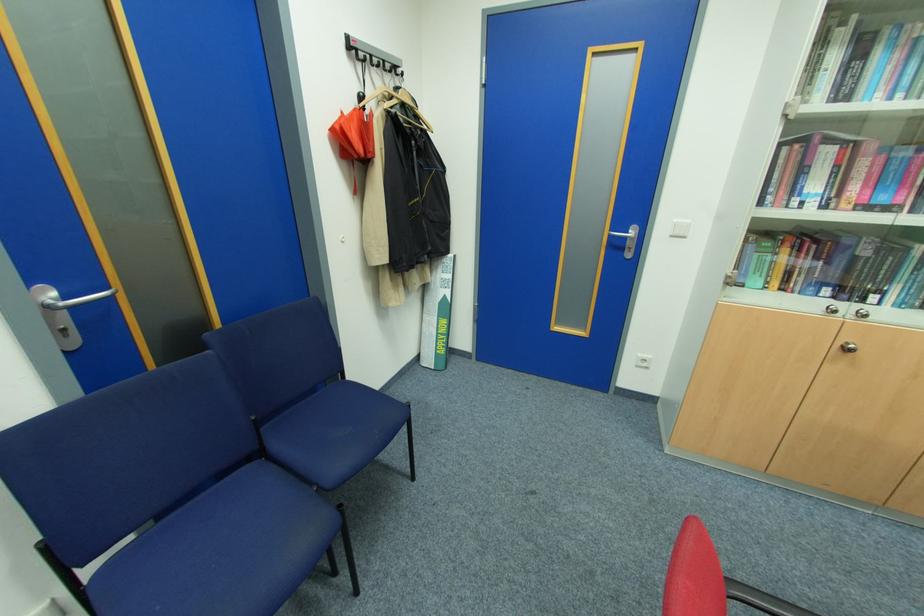
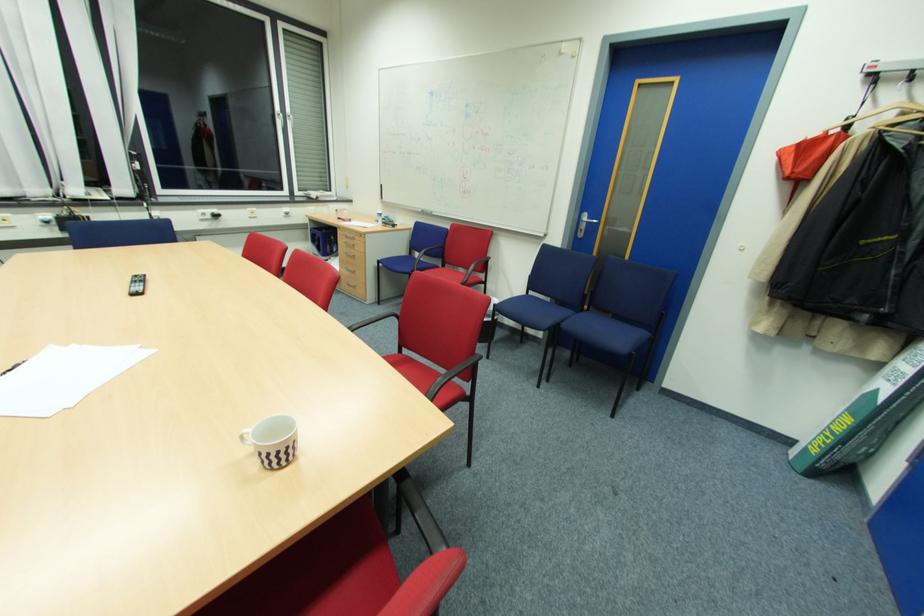
The point at [71,297] is marked in the first image. Where is the corresponding point in the second image?

(591, 220)